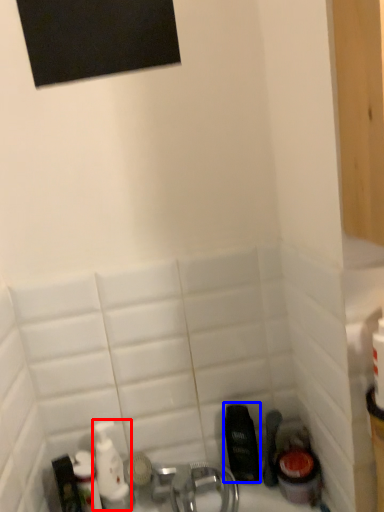
Question: Which object is closer to the camera taking this photo, mouthwash (highlighted by a red box) or mouthwash (highlighted by a blue box)?

Choices:
 (A) mouthwash
 (B) mouthwash

Answer: (A)